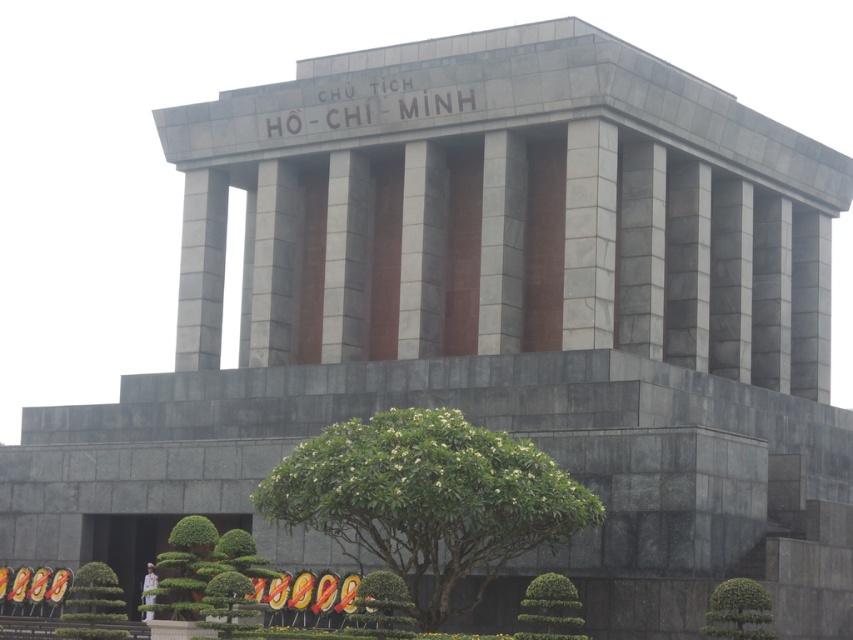
You are standing in front of the monumental structure and want to take a photo that includes both the green leafy tree at center and the green leafy hedge at lower right. Based on their positions, which object should be on the left side of your photo?

The green leafy tree at center should be on the left side of the photo because it is positioned to the left of the green leafy hedge at lower right.